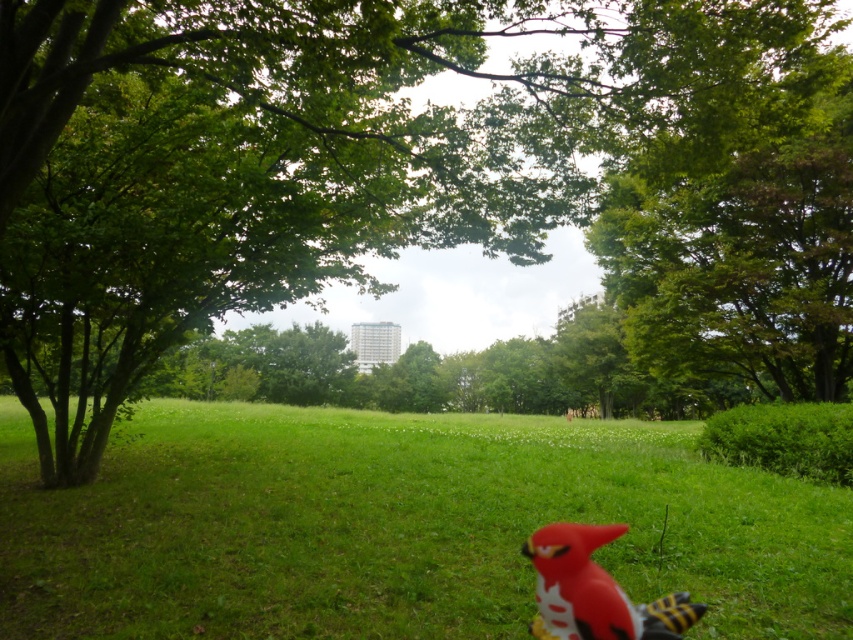
Which is below, green grassy field at center or rubber bird at lower center?

Positioned lower is green grassy field at center.

Is point (727, 566) positioned in front of point (581, 588)?

No.

Is point (190, 412) closer to camera compared to point (541, 614)?

No.

Where is `green grassy field at center`? green grassy field at center is located at coordinates (398, 525).

Does green leafy tree at upper right appear on the left side of rubber bird at lower center?

Incorrect, green leafy tree at upper right is not on the left side of rubber bird at lower center.

Is green leafy tree at upper right shorter than rubber bird at lower center?

No, green leafy tree at upper right is not shorter than rubber bird at lower center.

Who is more distant from viewer, (717, 141) or (544, 560)?

The point (717, 141) is more distant.

The height and width of the screenshot is (640, 853). Find the location of `green leafy tree at upper right`. green leafy tree at upper right is located at coordinates (741, 237).

Is point (78, 624) positioned before point (780, 388)?

Yes, it is in front of point (780, 388).

Between point (231, 465) and point (715, 195), which one is positioned in front?

Point (231, 465)

Does point (474, 529) come closer to viewer compared to point (752, 140)?

That is True.

Where is `green grassy field at center`? green grassy field at center is located at coordinates (398, 525).